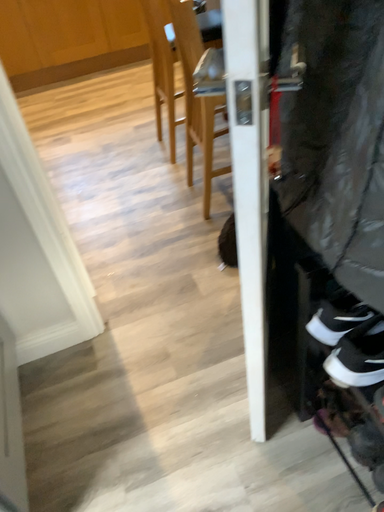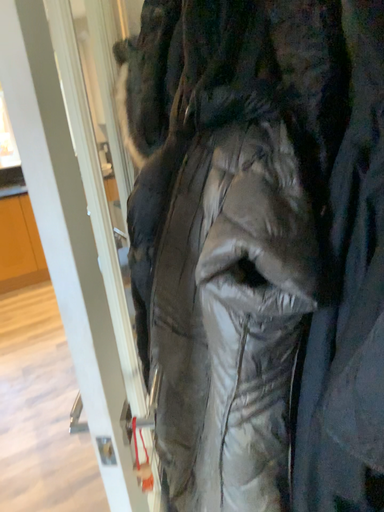
Question: Which way did the camera rotate in the video?

Choices:
 (A) rotated right
 (B) rotated left

Answer: (A)